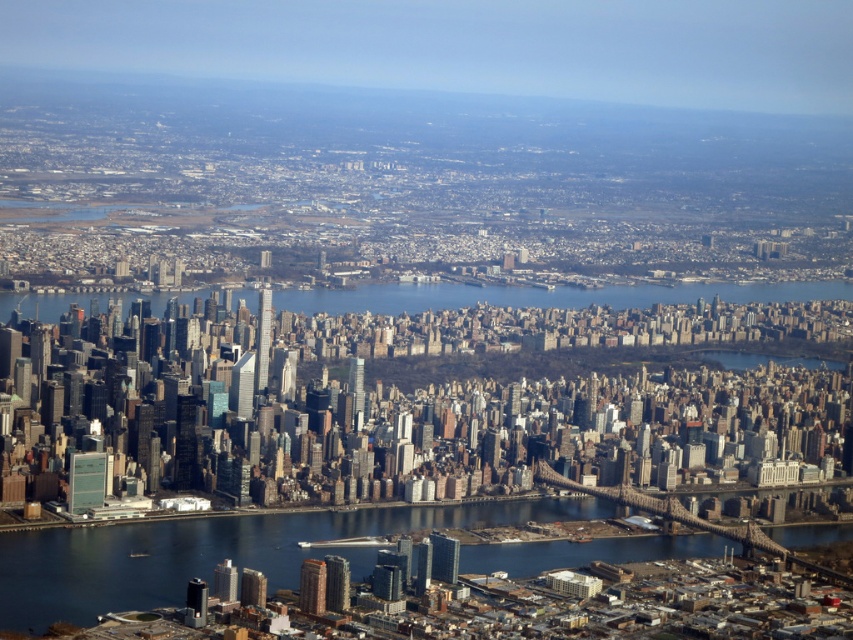
You are a drone operator who needs to deliver a package to a building on the opposite side of the river. The blue water at lower center and blue water at center are in your flight path. Which one of these waters is located below the other in the image?

The blue water at lower center is positioned under the blue water at center, so the blue water at lower center is located below the blue water at center in the image.

You are a drone operator trying to navigate between two points in the city. You see a point at coordinate (131, 525) and another at (404, 284). Which point is closer to your current position?

Point (131, 525) is further to the viewer than point (404, 284), so the point at (404, 284) is closer to your current position.